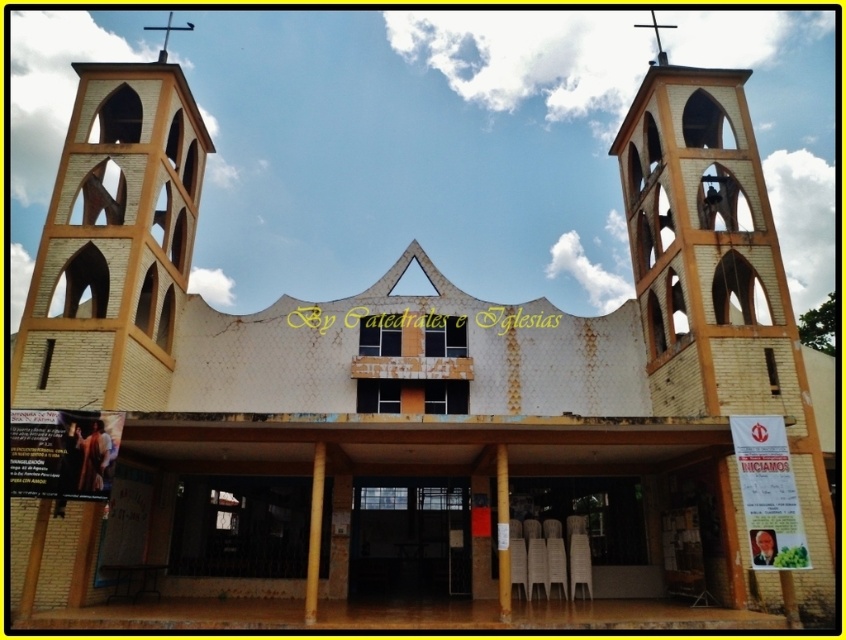
You are standing in front of the church and want to locate the yellow brick bell tower at upper center. What are the coordinates where you should look?

The yellow brick bell tower at upper center is located at coordinates point (114,243).

You are standing at the entrance of the church and notice the yellow brick bell tower at upper center and the smooth gold cross at upper center. Which object is positioned in front of the other?

The yellow brick bell tower at upper center is closer to the viewer than the smooth gold cross at upper center, so the yellow brick bell tower at upper center is positioned in front of the smooth gold cross at upper center.